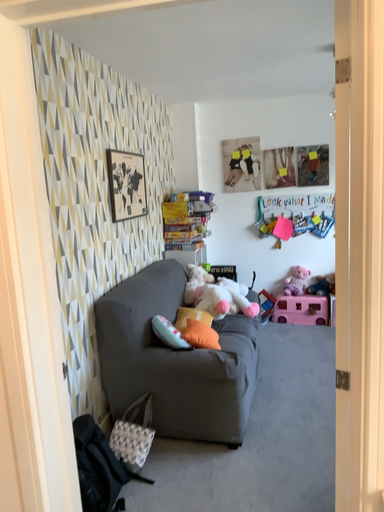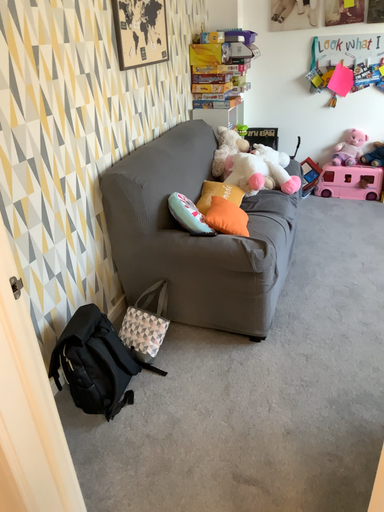
Question: How did the camera likely rotate when shooting the video?

Choices:
 (A) rotated downward
 (B) rotated upward

Answer: (A)